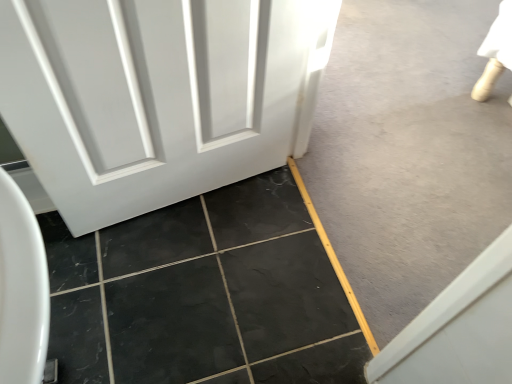
The height and width of the screenshot is (384, 512). Describe the element at coordinates (204, 294) in the screenshot. I see `black tile at lower left` at that location.

The image size is (512, 384). In order to click on black tile at lower left in this screenshot , I will do `click(204, 294)`.

Identify the location of black tile at lower left. (204, 294).